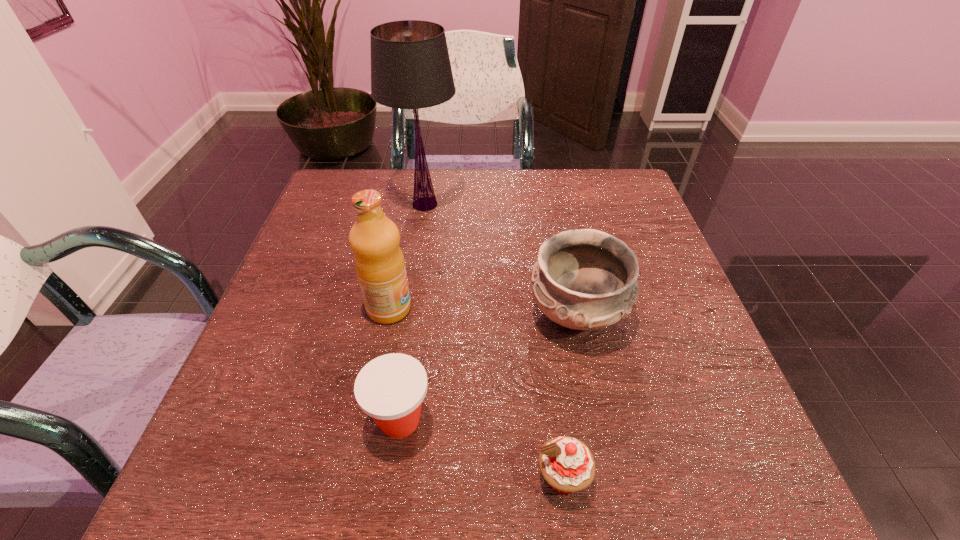
Where is `free space at the near right corner`? free space at the near right corner is located at coordinates point(682,476).

Where is `free space between the farthest object and the cupcake`? free space between the farthest object and the cupcake is located at coordinates (493, 341).

You are a GUI agent. You are given a task and a screenshot of the screen. Output one action in this format:
    pyautogui.click(x=<x>, y=<y>)
    Task: Click on the free area in between the lampshade and the pottery
    Image resolution: width=960 pixels, height=540 pixels.
    Given the screenshot: What is the action you would take?
    pyautogui.click(x=501, y=259)

Locate an element on the screen. The image size is (960, 540). free space between the farthest object and the pottery is located at coordinates (501, 259).

Find the location of a particular element. The width and height of the screenshot is (960, 540). free space between the cupcake and the tallest object is located at coordinates (493, 341).

Identify the location of free space that is in between the Dixie cup and the pottery. This screenshot has height=540, width=960. tap(488, 367).

The width and height of the screenshot is (960, 540). I want to click on free spot between the tallest object and the third tallest object, so click(501, 259).

Locate an element on the screen. vacant region between the cupcake and the lampshade is located at coordinates (493, 341).

Find the location of a particular element. The height and width of the screenshot is (540, 960). free space between the cupcake and the fourth shortest object is located at coordinates (476, 393).

Image resolution: width=960 pixels, height=540 pixels. Find the location of `object that is the closest to the fourth shortest object`. object that is the closest to the fourth shortest object is located at coordinates (390, 388).